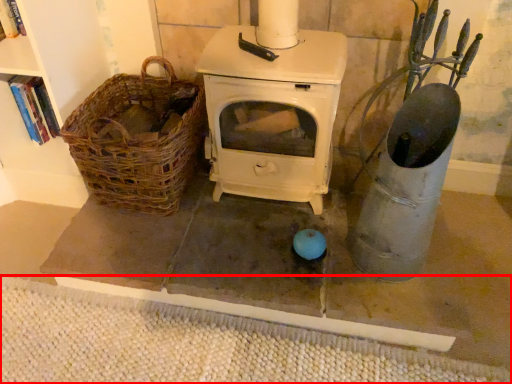
Question: From the image, what is the correct spatial relationship of mat (annotated by the red box) in relation to basket?

Choices:
 (A) right
 (B) left

Answer: (A)